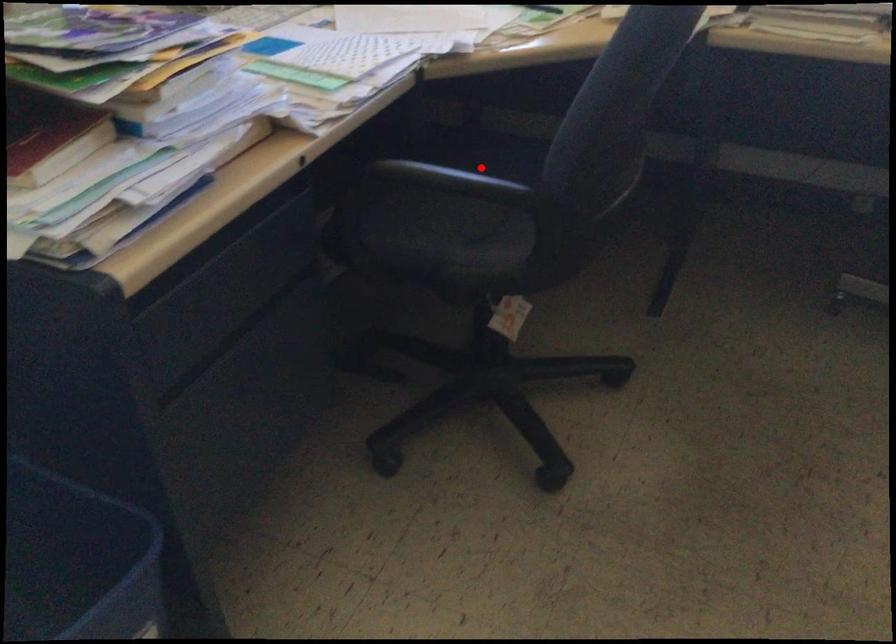
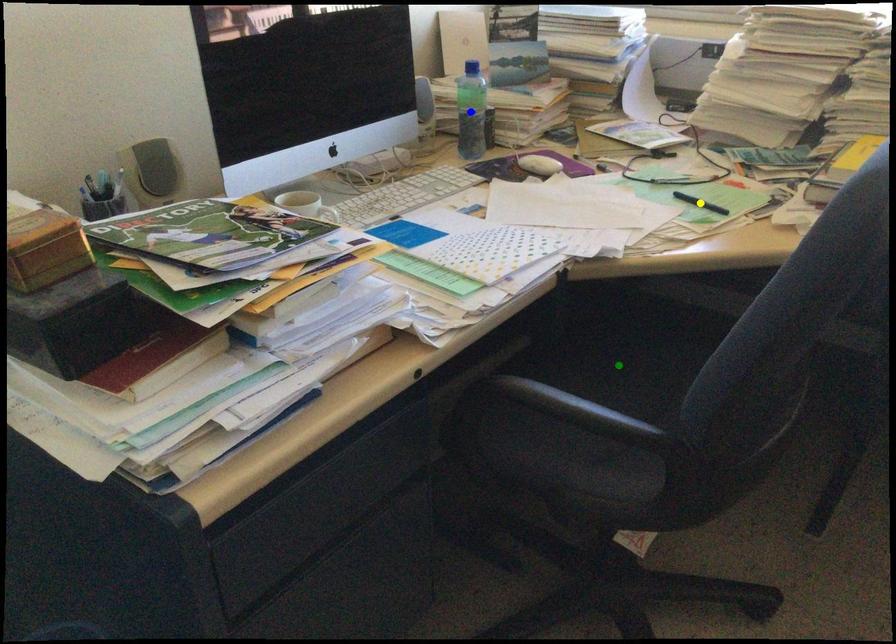
Question: I am providing you with two images of the same scene from different viewpoints. A red point is marked on the first image. You are given multiple points on the second image. Which mark in image 2 goes with the point in image 1?

Choices:
 (A) green point
 (B) blue point
 (C) yellow point

Answer: (A)